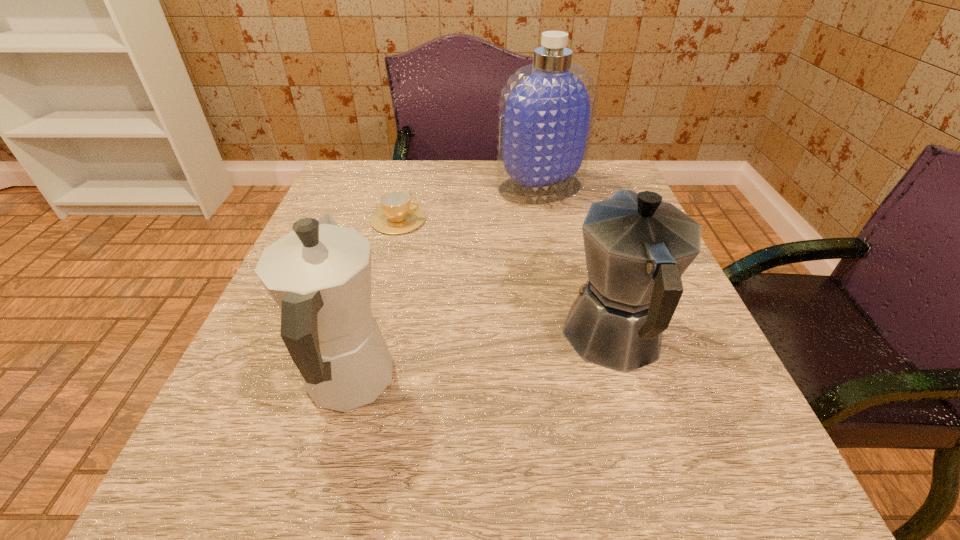
Identify the location of cleansing agent that is positioned at the far edge. (547, 109).

Locate an element on the screen. This screenshot has height=540, width=960. cup positioned at the far edge is located at coordinates (397, 215).

In order to click on coffeepot located in the left edge section of the desktop in this screenshot , I will do `click(319, 275)`.

Find the location of a particular element. The height and width of the screenshot is (540, 960). cup that is at the left edge is located at coordinates (397, 215).

Find the location of a particular element. The width and height of the screenshot is (960, 540). cleansing agent that is positioned at the right edge is located at coordinates (547, 109).

The width and height of the screenshot is (960, 540). Find the location of `coffeepot that is at the right edge`. coffeepot that is at the right edge is located at coordinates (637, 247).

Find the location of a particular element. The image size is (960, 540). object that is positioned at the far left corner is located at coordinates (397, 215).

Identify the location of object present at the far right corner. Image resolution: width=960 pixels, height=540 pixels. (547, 109).

What are the coordinates of `vacant space at the far edge` in the screenshot? It's located at (404, 162).

You are a GUI agent. You are given a task and a screenshot of the screen. Output one action in this format:
    pyautogui.click(x=<x>, y=<y>)
    Task: Click on the vacant point at the near edge
    This screenshot has height=540, width=960.
    Given the screenshot: What is the action you would take?
    pyautogui.click(x=608, y=461)